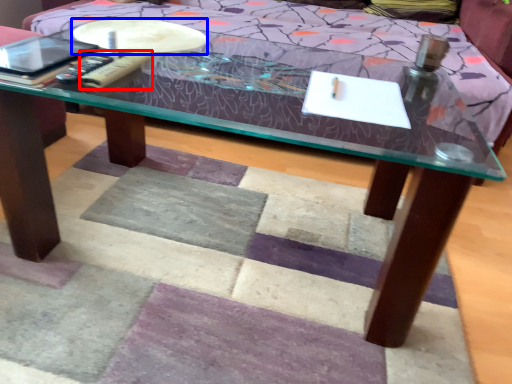
Question: Which of the following is the closest to the observer, remote (highlighted by a red box) or round table (highlighted by a blue box)?

Choices:
 (A) remote
 (B) round table

Answer: (A)